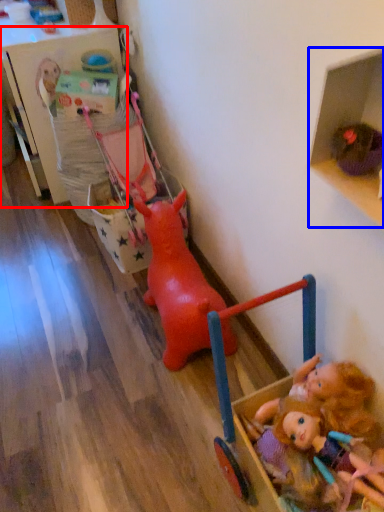
Question: Which object appears closest to the camera in this image, shelf (highlighted by a red box) or shelf (highlighted by a blue box)?

Choices:
 (A) shelf
 (B) shelf

Answer: (B)